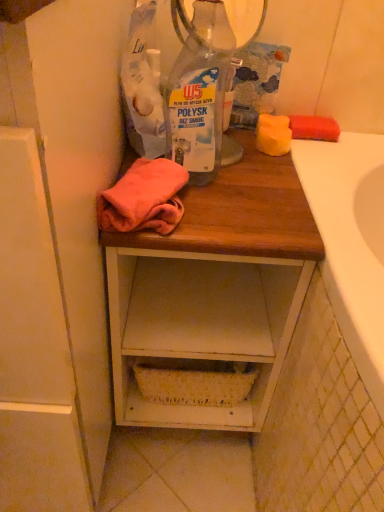
Question: From the image's perspective, would you say wooden desk at center is shown under white wood cabinet at left?

Choices:
 (A) yes
 (B) no

Answer: (A)

Question: Can you see wooden desk at center touching white wood cabinet at left?

Choices:
 (A) no
 (B) yes

Answer: (A)

Question: Does wooden desk at center turn towards white wood cabinet at left?

Choices:
 (A) no
 (B) yes

Answer: (A)

Question: Is wooden desk at center closer to camera compared to white wood cabinet at left?

Choices:
 (A) no
 (B) yes

Answer: (A)

Question: Is wooden desk at center at the left side of white wood cabinet at left?

Choices:
 (A) no
 (B) yes

Answer: (A)

Question: From the image's perspective, relative to transparent plastic bottle at center, is white wood cabinet at left above or below?

Choices:
 (A) above
 (B) below

Answer: (B)

Question: Is white wood cabinet at left spatially inside transparent plastic bottle at center, or outside of it?

Choices:
 (A) outside
 (B) inside

Answer: (A)

Question: Is point (11, 199) closer or farther from the camera than point (173, 84)?

Choices:
 (A) closer
 (B) farther

Answer: (A)

Question: From a real-world perspective, relative to transparent plastic bottle at center, is white wood cabinet at left vertically above or below?

Choices:
 (A) above
 (B) below

Answer: (B)

Question: From a real-world perspective, is wooden desk at center above or below white wood cabinet at left?

Choices:
 (A) above
 (B) below

Answer: (B)

Question: In the image, is wooden desk at center positioned in front of or behind white wood cabinet at left?

Choices:
 (A) front
 (B) behind

Answer: (B)

Question: Do you think wooden desk at center is within white wood cabinet at left, or outside of it?

Choices:
 (A) inside
 (B) outside

Answer: (B)

Question: Considering the positions of point (271, 187) and point (59, 86), is point (271, 187) closer or farther from the camera than point (59, 86)?

Choices:
 (A) farther
 (B) closer

Answer: (A)

Question: Considering the relative positions of wooden desk at center and transparent plastic bottle at center in the image provided, is wooden desk at center to the left or to the right of transparent plastic bottle at center?

Choices:
 (A) right
 (B) left

Answer: (B)

Question: Is point (251, 252) closer or farther from the camera than point (185, 49)?

Choices:
 (A) farther
 (B) closer

Answer: (B)